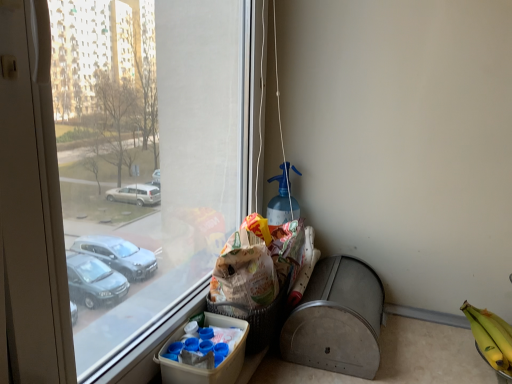
This screenshot has width=512, height=384. Identify the location of brown paper bag at lower center. (256, 319).

Describe the element at coordinates (204, 369) in the screenshot. The image size is (512, 384). I see `white cardboard box at lower center` at that location.

What do you see at coordinates (244, 275) in the screenshot?
I see `white paper grocery bag at center` at bounding box center [244, 275].

The image size is (512, 384). Find the location of `yellow matte bananas at lower right`. yellow matte bananas at lower right is located at coordinates (489, 338).

Based on the photo, is white cardboard box at lower center positioned behind metallic gray recycling bin at lower right?

No.

From the image's perspective, would you say white cardboard box at lower center is shown under metallic gray recycling bin at lower right?

Yes, from the image's perspective, white cardboard box at lower center is beneath metallic gray recycling bin at lower right.

How many degrees apart are the facing directions of white cardboard box at lower center and metallic gray recycling bin at lower right?

white cardboard box at lower center and metallic gray recycling bin at lower right are facing 4.36 degrees away from each other.

Are white cardboard box at lower center and metallic gray recycling bin at lower right far apart?

No, white cardboard box at lower center is not far from metallic gray recycling bin at lower right.

Who is smaller, metallic gray recycling bin at lower right or brown paper bag at lower center?

Smaller between the two is brown paper bag at lower center.

From the image's perspective, which one is positioned higher, metallic gray recycling bin at lower right or brown paper bag at lower center?

From the image's view, brown paper bag at lower center is above.

Is point (354, 310) behind point (275, 305)?

Yes, it is behind point (275, 305).

Consider the image. Between metallic gray recycling bin at lower right and brown paper bag at lower center, which one appears on the right side from the viewer's perspective?

From the viewer's perspective, metallic gray recycling bin at lower right appears more on the right side.

Measure the distance between brown paper bag at lower center and white cardboard box at lower center.

brown paper bag at lower center is 8.68 centimeters away from white cardboard box at lower center.

Which of these two, brown paper bag at lower center or white cardboard box at lower center, is wider?

With larger width is brown paper bag at lower center.

From a real-world perspective, is brown paper bag at lower center under white cardboard box at lower center?

No, from a real-world perspective, brown paper bag at lower center is not below white cardboard box at lower center.

What's the angular difference between brown paper bag at lower center and white cardboard box at lower center's facing directions?

9.97e-05 degrees separate the facing orientations of brown paper bag at lower center and white cardboard box at lower center.

From a real-world perspective, is metallic gray recycling bin at lower right below white cardboard box at lower center?

Correct, in the physical world, metallic gray recycling bin at lower right is lower than white cardboard box at lower center.

Is metallic gray recycling bin at lower right not near white cardboard box at lower center?

No, metallic gray recycling bin at lower right is in close proximity to white cardboard box at lower center.

Can you confirm if metallic gray recycling bin at lower right is shorter than white cardboard box at lower center?

Incorrect, the height of metallic gray recycling bin at lower right does not fall short of that of white cardboard box at lower center.

Which is in front, metallic gray recycling bin at lower right or white cardboard box at lower center?

white cardboard box at lower center is closer to the camera.

Is white cardboard box at lower center a part of white paper grocery bag at center?

Actually, white cardboard box at lower center is outside white paper grocery bag at center.

Between white paper grocery bag at center and white cardboard box at lower center, which one has less height?

Standing shorter between the two is white cardboard box at lower center.

Which is nearer, (275, 293) or (180, 336)?

The point (180, 336) is more forward.

From the image's perspective, between white paper grocery bag at center and white cardboard box at lower center, which one is located above?

white paper grocery bag at center is shown above in the image.

From a real-world perspective, is brown paper bag at lower center positioned above or below metallic gray recycling bin at lower right?

brown paper bag at lower center is situated higher than metallic gray recycling bin at lower right in the real world.

Is brown paper bag at lower center facing towards metallic gray recycling bin at lower right?

Yes.

Is point (246, 351) farther from camera compared to point (298, 361)?

No, it is not.

At what (x,y) coordinates should I click in order to perform the action: click on grocery bag that appears behind the white cardboard box at lower center. Please return your answer as a coordinate pair (x, y). This screenshot has width=512, height=384. Looking at the image, I should click on (244, 275).

From the picture: Between white cardboard box at lower center and white paper grocery bag at center, which one has larger size?

Bigger between the two is white cardboard box at lower center.

From a real-world perspective, which object stands above the other?

In real-world perspective, white paper grocery bag at center is above.

Does point (173, 363) lie behind point (253, 277)?

No, it is not.

Image resolution: width=512 pixels, height=384 pixels. Find the location of `cardboard box on the left of the metallic gray recycling bin at lower right`. cardboard box on the left of the metallic gray recycling bin at lower right is located at coordinates click(x=204, y=369).

There is a metallic gray recycling bin at lower right. At what (x,y) coordinates should I click in order to perform the action: click on basket above it (from a real-world perspective). Please return your answer as a coordinate pair (x, y). The height and width of the screenshot is (384, 512). Looking at the image, I should click on 256,319.

Considering their positions, is white paper grocery bag at center positioned further to yellow matte bananas at lower right than brown paper bag at lower center?

The object further to yellow matte bananas at lower right is white paper grocery bag at center.

Estimate the real-world distances between objects in this image. Which object is closer to brown paper bag at lower center, white cardboard box at lower center or white paper grocery bag at center?

white paper grocery bag at center is positioned closer to the anchor brown paper bag at lower center.

Estimate the real-world distances between objects in this image. Which object is closer to brown paper bag at lower center, white paper grocery bag at center or white cardboard box at lower center?

Among the two, white paper grocery bag at center is located nearer to brown paper bag at lower center.

Which object lies further to the anchor point yellow matte bananas at lower right, metallic gray recycling bin at lower right or brown paper bag at lower center?

brown paper bag at lower center.

Based on their spatial positions, is brown paper bag at lower center or metallic gray recycling bin at lower right closer to yellow matte bananas at lower right?

Based on the image, metallic gray recycling bin at lower right appears to be nearer to yellow matte bananas at lower right.

When comparing their distances from yellow matte bananas at lower right, does metallic gray recycling bin at lower right or white cardboard box at lower center seem closer?

metallic gray recycling bin at lower right is positioned closer to the anchor yellow matte bananas at lower right.

When comparing their distances from white cardboard box at lower center, does brown paper bag at lower center or metallic gray recycling bin at lower right seem closer?

brown paper bag at lower center is positioned closer to the anchor white cardboard box at lower center.

Considering their positions, is white paper grocery bag at center positioned closer to brown paper bag at lower center than metallic gray recycling bin at lower right?

white paper grocery bag at center is closer to brown paper bag at lower center.

The image size is (512, 384). Identify the location of recycling bin between white paper grocery bag at center and yellow matte bananas at lower right from left to right. pyautogui.click(x=337, y=319).

You are a GUI agent. You are given a task and a screenshot of the screen. Output one action in this format:
    pyautogui.click(x=<x>, y=<y>)
    Task: Click on the recycling bin between white cardboard box at lower center and yellow matte bananas at lower right
    The width and height of the screenshot is (512, 384).
    Given the screenshot: What is the action you would take?
    pyautogui.click(x=337, y=319)

This screenshot has height=384, width=512. Identify the location of basket located between white paper grocery bag at center and yellow matte bananas at lower right in the left-right direction. (256, 319).

What are the coordinates of `basket between white paper grocery bag at center and metallic gray recycling bin at lower right from left to right` in the screenshot? It's located at (256, 319).